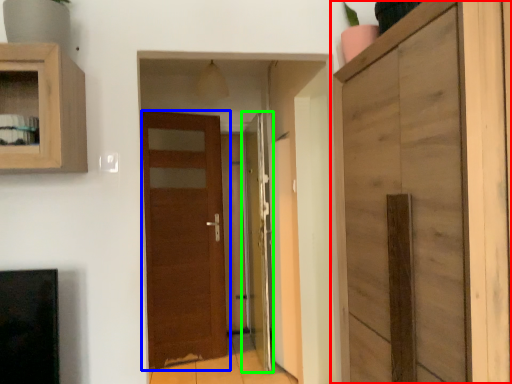
Question: Estimate the real-world distances between objects in this image. Which object is farther from cupboard (highlighted by a red box), door (highlighted by a blue box) or door (highlighted by a green box)?

Choices:
 (A) door
 (B) door

Answer: (A)